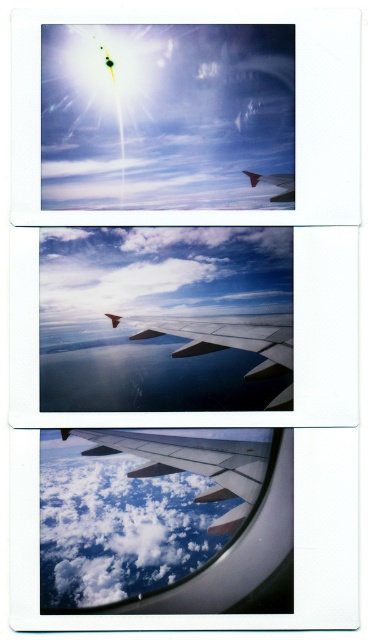
Is cloudy white cloud at center closer to the viewer compared to matte metallic wing at center?

Yes, cloudy white cloud at center is in front of matte metallic wing at center.

What do you see at coordinates (118, 528) in the screenshot? This screenshot has width=368, height=640. I see `cloudy white cloud at center` at bounding box center [118, 528].

What are the coordinates of `cloudy white cloud at center` in the screenshot? It's located at (118, 528).

Is point (210, 536) in front of point (267, 316)?

That is True.

Does cloudy white cloud at center appear on the right side of metallic silver wing at center?

No, cloudy white cloud at center is not to the right of metallic silver wing at center.

Where is `cloudy white cloud at center`? The height and width of the screenshot is (640, 368). cloudy white cloud at center is located at coordinates (118, 528).

Between matte metallic wing at center and metallic silver wing at center, which one has less height?

With less height is metallic silver wing at center.

Is point (185, 451) behind point (151, 321)?

No, (185, 451) is in front of (151, 321).

Is point (168, 442) farther from camera compared to point (111, 324)?

No, (168, 442) is in front of (111, 324).

Image resolution: width=368 pixels, height=640 pixels. Find the location of `matte metallic wing at center`. matte metallic wing at center is located at coordinates (192, 465).